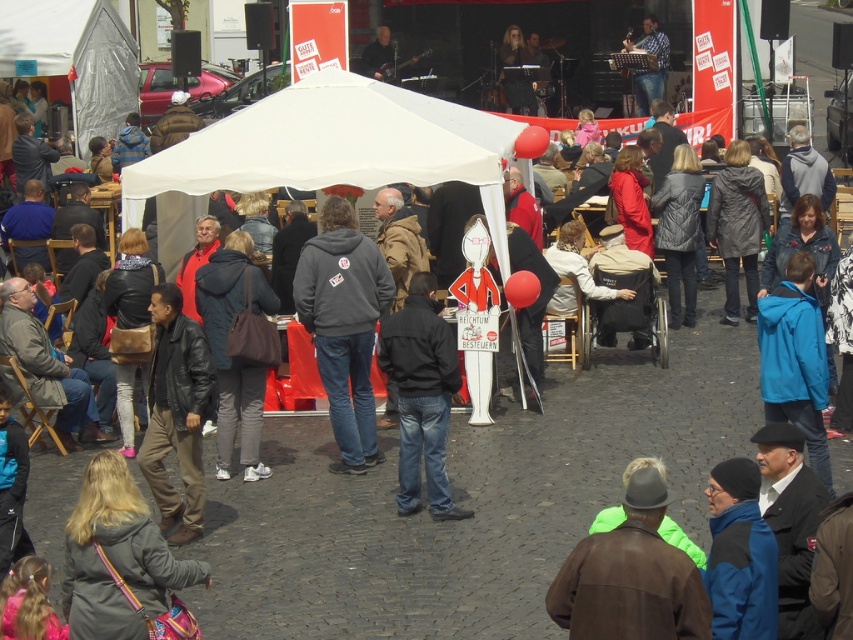
Is gray hoodie at center taller than dark blue jacket at center?

Yes, gray hoodie at center is taller than dark blue jacket at center.

Can you confirm if gray hoodie at center is wider than dark blue jacket at center?

→ Yes, gray hoodie at center is wider than dark blue jacket at center.

Is point (322, 294) farther from viewer compared to point (254, 406)?

That is False.

Where is `gray hoodie at center`? The image size is (853, 640). gray hoodie at center is located at coordinates (344, 324).

Between black matte jacket at center and dark blue jacket at center, which one has less height?

With less height is black matte jacket at center.

What do you see at coordinates (421, 396) in the screenshot?
I see `black matte jacket at center` at bounding box center [421, 396].

Image resolution: width=853 pixels, height=640 pixels. I want to click on black matte jacket at center, so click(x=421, y=396).

Which is more to the left, brown leather jacket at lower right or black matte jacket at center?

Positioned to the left is black matte jacket at center.

The height and width of the screenshot is (640, 853). In order to click on brown leather jacket at lower right in this screenshot , I will do 631,573.